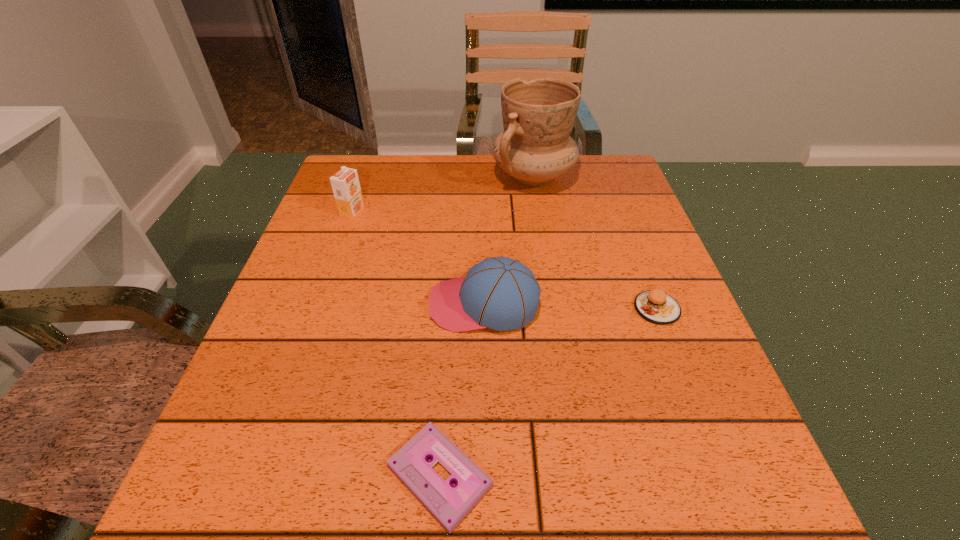
In order to click on vacant area that lies between the tallest object and the rightmost object in this screenshot , I will do `click(595, 242)`.

The height and width of the screenshot is (540, 960). I want to click on free space between the farthest object and the fourth tallest object, so click(595, 242).

I want to click on empty location between the baseball cap and the leftmost object, so click(419, 258).

Find the location of `vacant space that's between the orange juice and the pottery`. vacant space that's between the orange juice and the pottery is located at coordinates (443, 194).

Find the location of a particular element. vacant area that lies between the baseball cap and the orange juice is located at coordinates [419, 258].

Where is `vacant area between the third shortest object and the leftmost object`? This screenshot has height=540, width=960. vacant area between the third shortest object and the leftmost object is located at coordinates (419, 258).

Find the location of `object identified as the third closest to the baseball cap`. object identified as the third closest to the baseball cap is located at coordinates (345, 184).

Identify which object is the nearest to the farthest object. Please provide its 2D coordinates. Your answer should be formatted as a tuple, i.e. [(x, y)], where the tuple contains the x and y coordinates of a point satisfying the conditions above.

[(500, 293)]

Image resolution: width=960 pixels, height=540 pixels. In order to click on vacant space that satisfies the following two spatial constraints: 1. on the front-facing side of the baseball cap; 2. on the back side of the fourth tallest object in this screenshot , I will do `click(484, 308)`.

Identify the location of blank area in the image that satisfies the following two spatial constraints: 1. on the back side of the shortest object; 2. on the left side of the farthest object. (459, 176).